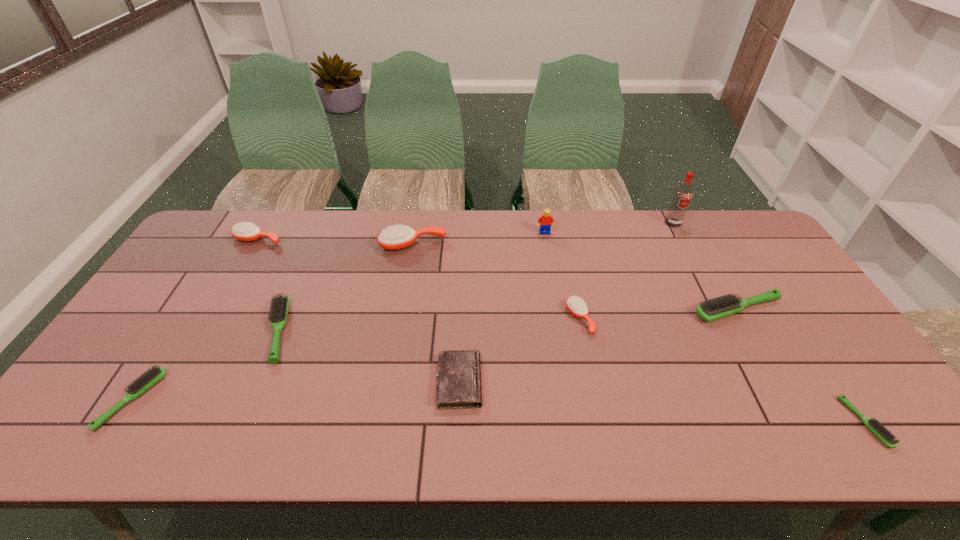
Locate an element on the screen. This screenshot has height=540, width=960. vacant space that's between the diary and the nearest orange hairbrush is located at coordinates (519, 350).

At what (x,y) coordinates should I click in order to perform the action: click on free space between the diary and the shortest object. Please return your answer as a coordinate pair (x, y). The image size is (960, 540). Looking at the image, I should click on (662, 402).

Where is `vacant region between the third smallest light hairbrush and the sixth object from right to left`? vacant region between the third smallest light hairbrush and the sixth object from right to left is located at coordinates (369, 356).

Where is `free space between the nearest orange hairbrush and the biggest light hairbrush`? This screenshot has width=960, height=540. free space between the nearest orange hairbrush and the biggest light hairbrush is located at coordinates (659, 314).

Identify the location of free spot between the fourth hairbrush from left to right and the third hairbrush from right to left. [496, 282].

Where is `unoccupied position between the nearest orange hairbrush and the diary`? unoccupied position between the nearest orange hairbrush and the diary is located at coordinates (519, 350).

Select which object appears as the second closest to the leftmost orange hairbrush. Please provide its 2D coordinates. Your answer should be formatted as a tuple, i.e. [(x, y)], where the tuple contains the x and y coordinates of a point satisfying the conditions above.

[(398, 237)]

You are a GUI agent. You are given a task and a screenshot of the screen. Output one action in this format:
    pyautogui.click(x=<x>, y=<y>)
    Task: Click on the ninth closest object to the fifth hairbrush from left to right
    
    Given the screenshot: What is the action you would take?
    pyautogui.click(x=153, y=375)

Identify which hairbrush is the nearest to the second orange hairbrush from right to left. Please provide its 2D coordinates. Your answer should be formatted as a tuple, i.e. [(x, y)], where the tuple contains the x and y coordinates of a point satisfying the conditions above.

[(280, 304)]

This screenshot has height=540, width=960. In order to click on the third closest hairbrush to the sixth object from right to left in this screenshot , I will do `click(280, 304)`.